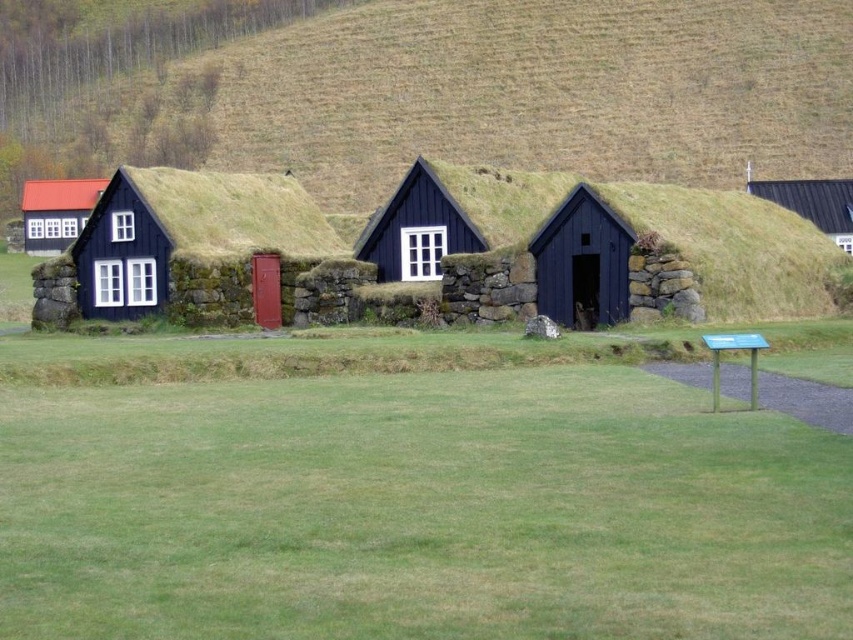
Question: Can you confirm if black wooden cottage at left is thinner than black grass-covered cottage at center?

Choices:
 (A) yes
 (B) no

Answer: (B)

Question: Is green grass at center below matte black cottage at center?

Choices:
 (A) no
 (B) yes

Answer: (B)

Question: Which object is positioned farthest from the matte black cottage at center?

Choices:
 (A) green grass at center
 (B) black wooden cottage at left
 (C) black grass-covered cottage at center

Answer: (A)

Question: Does green grass at center have a greater width compared to matte black cottage at left?

Choices:
 (A) no
 (B) yes

Answer: (B)

Question: Which point is closer to the camera?

Choices:
 (A) matte black cottage at left
 (B) green grassy hillside at upper center
 (C) green grass at center

Answer: (C)

Question: Which of the following is the farthest from the observer?

Choices:
 (A) green grassy hillside at upper center
 (B) matte black cottage at center
 (C) green grass at center
 (D) black wooden cottage at left

Answer: (A)